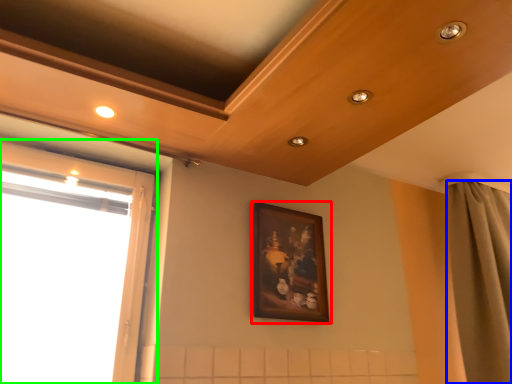
Question: Based on their relative distances, which object is nearer to picture frame (highlighted by a red box)? Choose from curtain (highlighted by a blue box) and window (highlighted by a green box).

Choices:
 (A) curtain
 (B) window

Answer: (B)